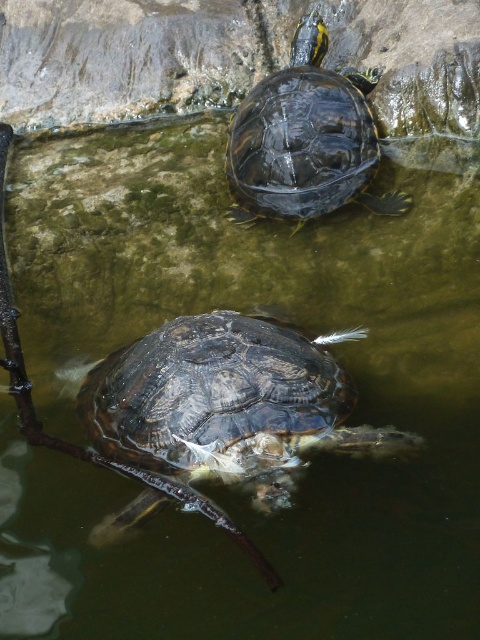
Between shiny dark turtle at center and shiny dark turtle at upper center, which one has more height?

Standing taller between the two is shiny dark turtle at upper center.

This screenshot has height=640, width=480. Describe the element at coordinates (220, 410) in the screenshot. I see `shiny dark turtle at center` at that location.

Which is behind, point (259, 440) or point (235, 218)?

Positioned behind is point (235, 218).

Locate an element on the screen. The height and width of the screenshot is (640, 480). shiny dark turtle at center is located at coordinates (220, 410).